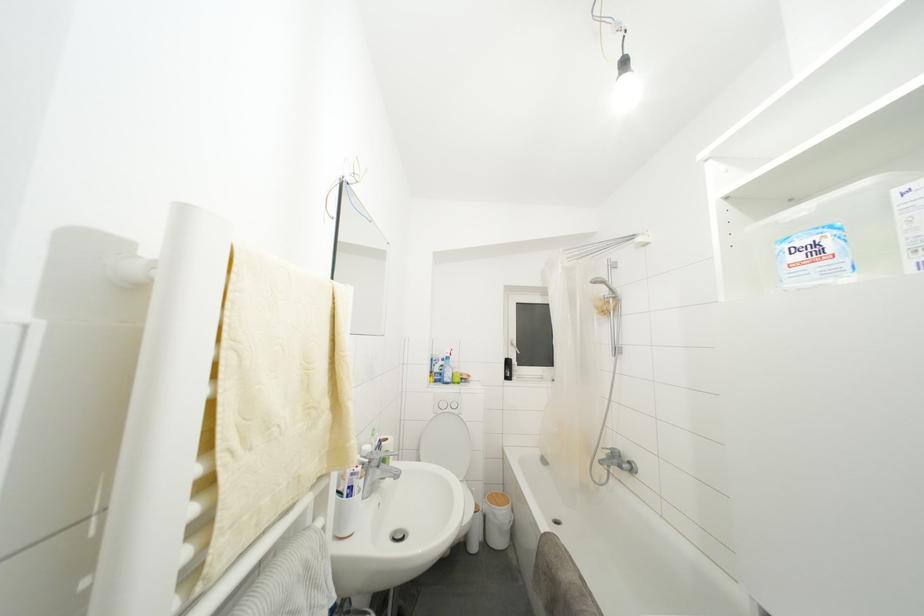
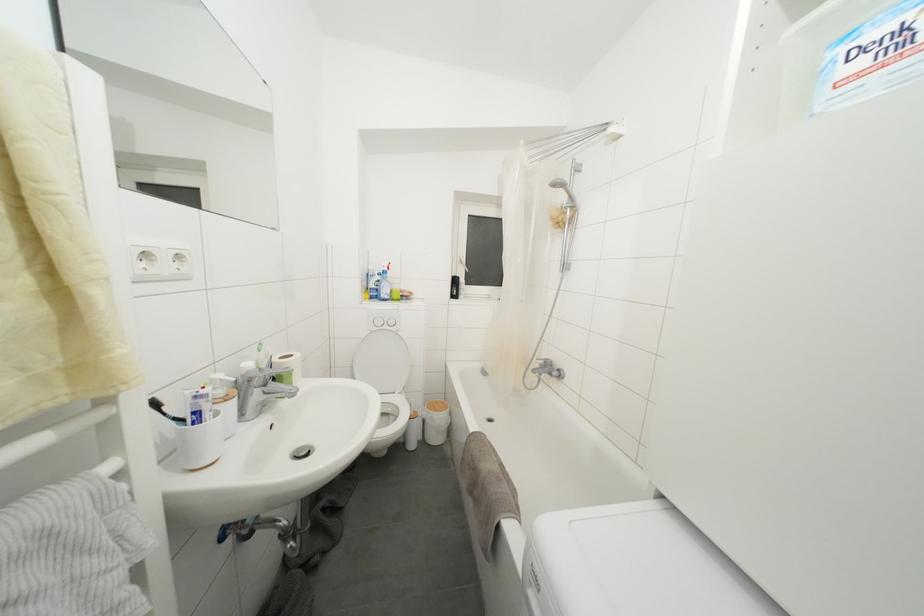
What movement of the cameraman would produce the second image?

The movement direction of the cameraman is right, forward.